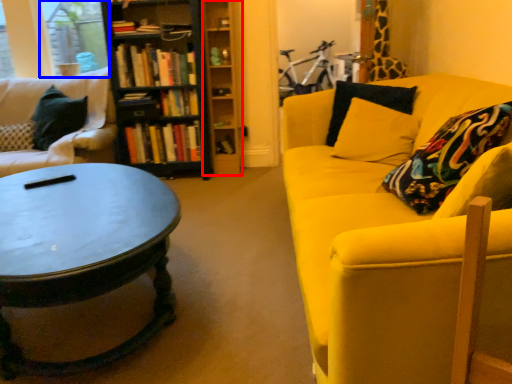
Question: Which of the following is the closest to the observer, shelf (highlighted by a red box) or window screen (highlighted by a blue box)?

Choices:
 (A) shelf
 (B) window screen

Answer: (A)